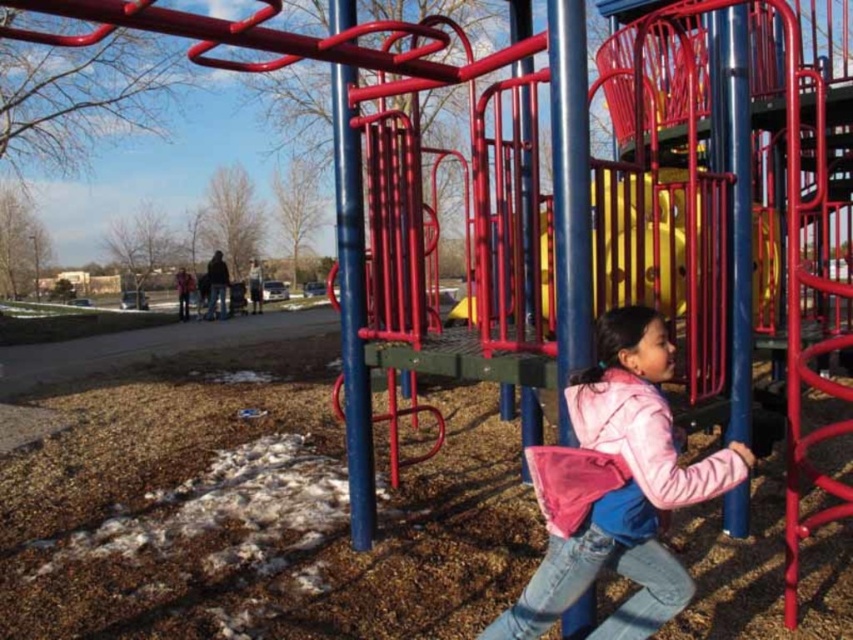
Does pink fleece jacket at center have a greater width compared to yellow plastic slide at center?

In fact, pink fleece jacket at center might be narrower than yellow plastic slide at center.

Is pink fleece jacket at center closer to the viewer compared to yellow plastic slide at center?

Yes, it is.

Identify the location of pink fleece jacket at center. (616, 486).